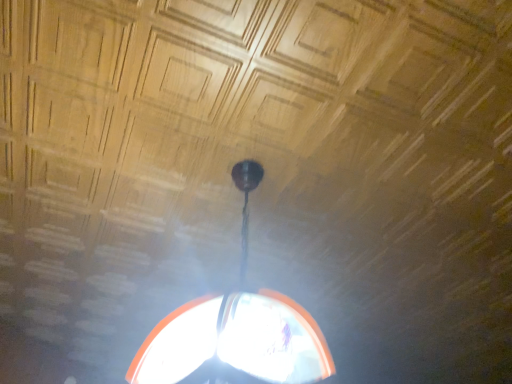
The width and height of the screenshot is (512, 384). In order to click on matte black lamp at center in this screenshot , I will do `click(234, 331)`.

Image resolution: width=512 pixels, height=384 pixels. What do you see at coordinates (234, 331) in the screenshot?
I see `matte black lamp at center` at bounding box center [234, 331].

The height and width of the screenshot is (384, 512). What are the coordinates of `matte black lamp at center` in the screenshot? It's located at (234, 331).